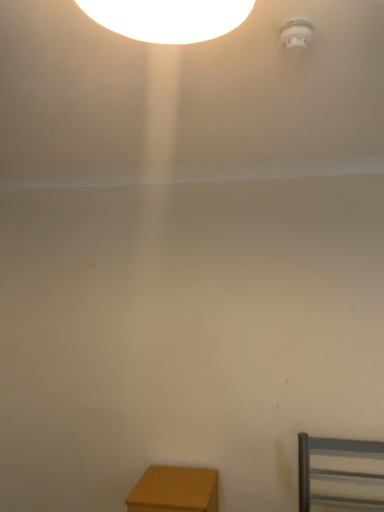
What is the approximate height of matte wood table at lower left?

The height of matte wood table at lower left is 11.46 inches.

At what (x,y) coordinates should I click in order to perform the action: click on matte wood table at lower left. Please return your answer as a coordinate pair (x, y). Looking at the image, I should click on (175, 490).

Describe the element at coordinates (175, 490) in the screenshot. The image size is (384, 512). I see `matte wood table at lower left` at that location.

Find the location of `white plastic smoke detector at upper right`. white plastic smoke detector at upper right is located at coordinates (296, 33).

Image resolution: width=384 pixels, height=512 pixels. What do you see at coordinates (296, 33) in the screenshot?
I see `white plastic smoke detector at upper right` at bounding box center [296, 33].

The height and width of the screenshot is (512, 384). What are the coordinates of `matte wood table at lower left` in the screenshot? It's located at (175, 490).

Which is more to the right, white plastic smoke detector at upper right or matte wood table at lower left?

Positioned to the right is white plastic smoke detector at upper right.

Which is behind, white plastic smoke detector at upper right or matte wood table at lower left?

matte wood table at lower left is further away from the camera.

Between point (287, 27) and point (211, 495), which one is positioned in front?

The point (287, 27) is closer.

From the image's perspective, is white plastic smoke detector at upper right on matte wood table at lower left?

Correct, white plastic smoke detector at upper right appears higher than matte wood table at lower left in the image.

From a real-world perspective, who is located higher, white plastic smoke detector at upper right or matte wood table at lower left?

white plastic smoke detector at upper right.

Can you confirm if white plastic smoke detector at upper right is thinner than matte wood table at lower left?

Correct, the width of white plastic smoke detector at upper right is less than that of matte wood table at lower left.

Does white plastic smoke detector at upper right have a greater height compared to matte wood table at lower left?

In fact, white plastic smoke detector at upper right may be shorter than matte wood table at lower left.

Between white plastic smoke detector at upper right and matte wood table at lower left, which one has larger size?

Bigger between the two is matte wood table at lower left.

Is white plastic smoke detector at upper right outside of matte wood table at lower left?

white plastic smoke detector at upper right is positioned outside matte wood table at lower left.

Is white plastic smoke detector at upper right next to matte wood table at lower left and touching it?

They are not placed beside each other.

Is white plastic smoke detector at upper right positioned with its back to matte wood table at lower left?

No.

Can you tell me how much white plastic smoke detector at upper right and matte wood table at lower left differ in facing direction?

They differ by 3.61 degrees in their facing directions.

Image resolution: width=384 pixels, height=512 pixels. I want to click on furniture lying below the white plastic smoke detector at upper right (from the image's perspective), so click(175, 490).

Which object is positioned more to the right, matte wood table at lower left or white plastic smoke detector at upper right?

white plastic smoke detector at upper right is more to the right.

Consider the image. Between matte wood table at lower left and white plastic smoke detector at upper right, which one is positioned behind?

matte wood table at lower left.

Does point (160, 471) lie behind point (299, 29)?

Yes, point (160, 471) is behind point (299, 29).

From the image's perspective, is matte wood table at lower left under white plastic smoke detector at upper right?

Indeed, from the image's perspective, matte wood table at lower left is shown beneath white plastic smoke detector at upper right.

From a real-world perspective, does matte wood table at lower left stand above white plastic smoke detector at upper right?

No, from a real-world perspective, matte wood table at lower left is not above white plastic smoke detector at upper right.

Considering the relative sizes of matte wood table at lower left and white plastic smoke detector at upper right in the image provided, is matte wood table at lower left wider than white plastic smoke detector at upper right?

Indeed, matte wood table at lower left has a greater width compared to white plastic smoke detector at upper right.

Looking at this image, considering the sizes of objects matte wood table at lower left and white plastic smoke detector at upper right in the image provided, who is taller, matte wood table at lower left or white plastic smoke detector at upper right?

matte wood table at lower left.

Looking at the image, does matte wood table at lower left seem bigger or smaller compared to white plastic smoke detector at upper right?

matte wood table at lower left is bigger than white plastic smoke detector at upper right.

Is matte wood table at lower left completely or partially outside of white plastic smoke detector at upper right?

Yes, matte wood table at lower left is located beyond the bounds of white plastic smoke detector at upper right.

From the picture: Is matte wood table at lower left next to white plastic smoke detector at upper right and touching it?

No, matte wood table at lower left is not with white plastic smoke detector at upper right.

Could you tell me if matte wood table at lower left is facing white plastic smoke detector at upper right?

No, matte wood table at lower left is not aimed at white plastic smoke detector at upper right.

There is a matte wood table at lower left. Where is `lamp above it (from a real-world perspective)`? lamp above it (from a real-world perspective) is located at coordinates (296, 33).

You are a GUI agent. You are given a task and a screenshot of the screen. Output one action in this format:
    pyautogui.click(x=<x>, y=<y>)
    Task: Click on the furniture on the left of white plastic smoke detector at upper right
    The height and width of the screenshot is (512, 384).
    Given the screenshot: What is the action you would take?
    pyautogui.click(x=175, y=490)

Image resolution: width=384 pixels, height=512 pixels. I want to click on furniture behind the white plastic smoke detector at upper right, so pos(175,490).